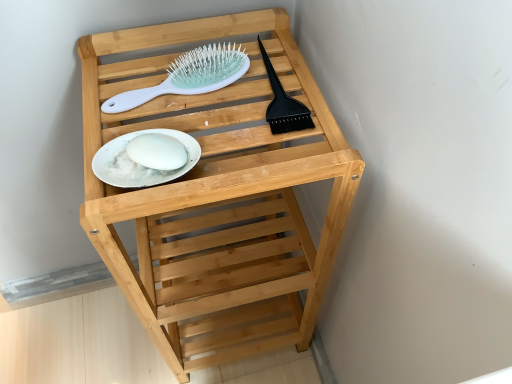
Question: Looking at their shapes, would you say white glossy plate at center is wider or thinner than white plastic hairbrush at upper center?

Choices:
 (A) thin
 (B) wide

Answer: (A)

Question: From the image's perspective, is white glossy plate at center located above or below white plastic hairbrush at upper center?

Choices:
 (A) below
 (B) above

Answer: (A)

Question: Which of these objects is positioned closest to the white plastic hairbrush at upper center?

Choices:
 (A) white glossy plate at center
 (B) natural wood shelf at center

Answer: (A)

Question: Estimate the real-world distances between objects in this image. Which object is farther from the white glossy plate at center?

Choices:
 (A) white plastic hairbrush at upper center
 (B) natural wood shelf at center

Answer: (B)